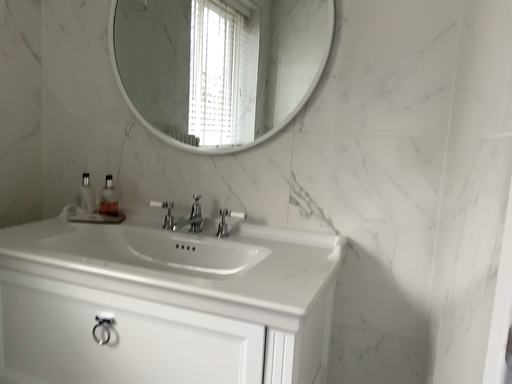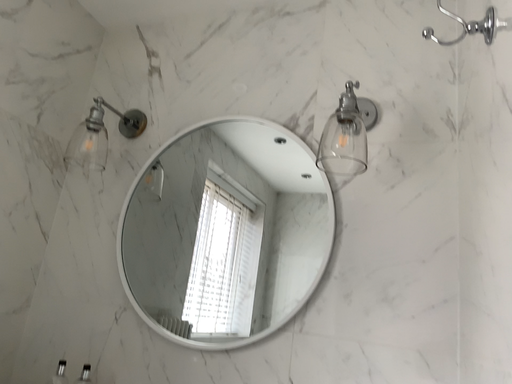
Question: How did the camera likely rotate when shooting the video?

Choices:
 (A) rotated upward
 (B) rotated downward

Answer: (A)